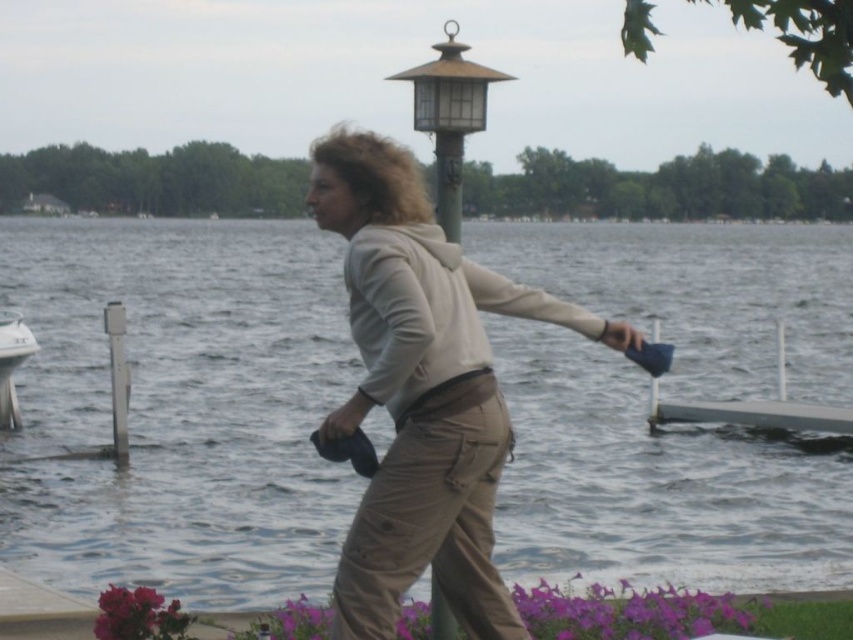
Question: Which object appears farthest from the camera in this image?

Choices:
 (A) metallic gold lamp post at upper center
 (B) beige cotton hoodie at center
 (C) khaki pants at center
 (D) clear water at center

Answer: (A)

Question: Can you confirm if clear water at center is wider than metallic gold lamp post at upper center?

Choices:
 (A) no
 (B) yes

Answer: (B)

Question: Is khaki pants at center smaller than metallic gold lamp post at upper center?

Choices:
 (A) no
 (B) yes

Answer: (A)

Question: Which of the following is the farthest from the observer?

Choices:
 (A) clear water at center
 (B) white plastic boat at left
 (C) khaki pants at center

Answer: (B)

Question: Which of the following is the closest to the observer?

Choices:
 (A) (550, 509)
 (B) (436, 211)
 (C) (724, 413)
 (D) (6, 317)

Answer: (B)

Question: Does khaki pants at center have a greater width compared to white plastic boat at left?

Choices:
 (A) no
 (B) yes

Answer: (B)